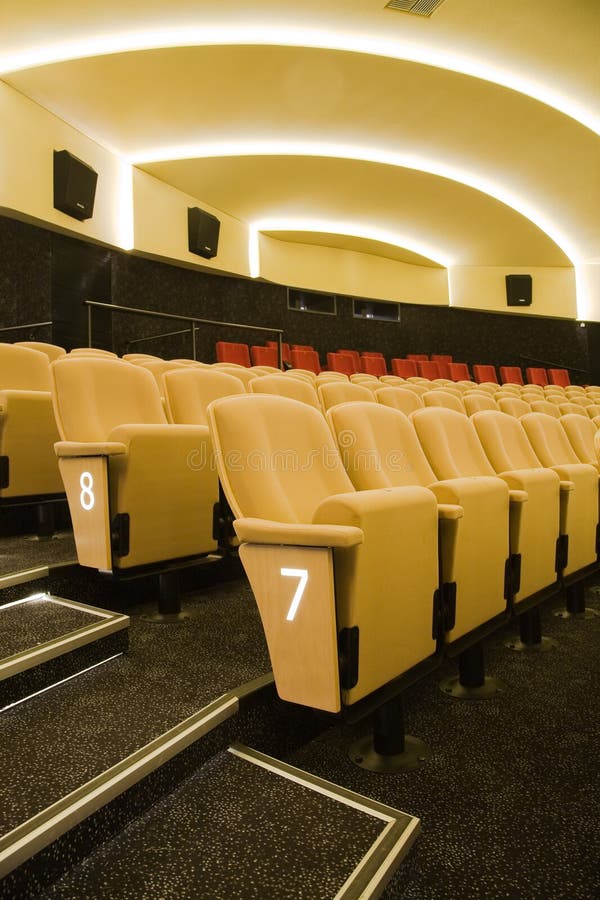
At what (x,y) coordinates should I click in order to perform the action: click on seat of yellow movie seat. Please return your answer as a coordinate pair (x, y). The image size is (600, 900). Looking at the image, I should click on (575, 513), (540, 520), (485, 528), (412, 552), (164, 478), (39, 444).